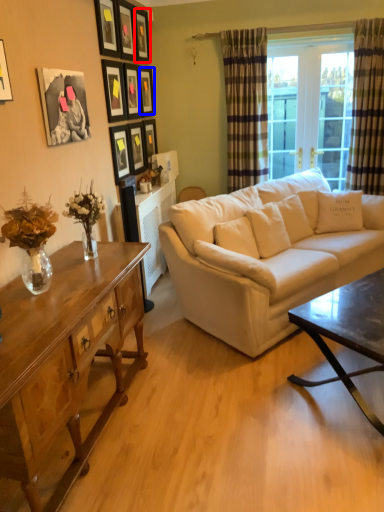
Question: Which point is further to the camera, picture frame (highlighted by a red box) or picture frame (highlighted by a blue box)?

Choices:
 (A) picture frame
 (B) picture frame

Answer: (B)